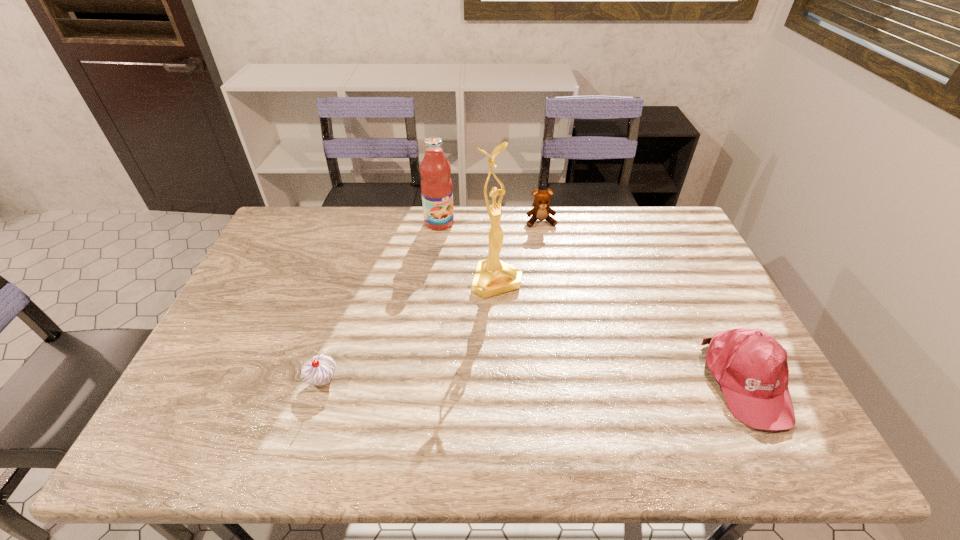
Image resolution: width=960 pixels, height=540 pixels. Identify the location of blank area located 0.090m on the front-facing side of the tallest object. coord(523,318).

This screenshot has height=540, width=960. Find the location of `free space located 0.140m on the front label of the fruit juice`. free space located 0.140m on the front label of the fruit juice is located at coordinates (466, 253).

The width and height of the screenshot is (960, 540). What are the coordinates of `free space located 0.400m on the front label of the fruit juice` in the screenshot? It's located at (508, 301).

Find the location of `vacant region located on the front label of the fruit juice`. vacant region located on the front label of the fruit juice is located at coordinates (506, 299).

The height and width of the screenshot is (540, 960). I want to click on vacant space situated 0.230m on the front-facing side of the fourth object from left to right, so pos(555,272).

I want to click on vacant point located 0.250m on the front-facing side of the fourth object from left to right, so click(x=556, y=276).

Find the location of a particular element. vacant space located on the front-facing side of the fourth object from left to right is located at coordinates (564, 305).

Where is `fruit juice at the far edge`? fruit juice at the far edge is located at coordinates (436, 186).

Where is `teddy bear positioned at the far edge`? The width and height of the screenshot is (960, 540). teddy bear positioned at the far edge is located at coordinates (541, 210).

Locate an element on the screen. The width and height of the screenshot is (960, 540). cupcake that is at the near edge is located at coordinates (318, 371).